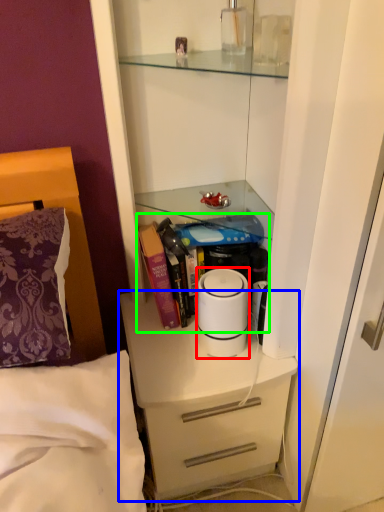
Question: Considering the real-world distances, which object is farthest from home appliance (highlighted by a red box)? chest of drawers (highlighted by a blue box) or book (highlighted by a green box)?

Choices:
 (A) chest of drawers
 (B) book

Answer: (A)